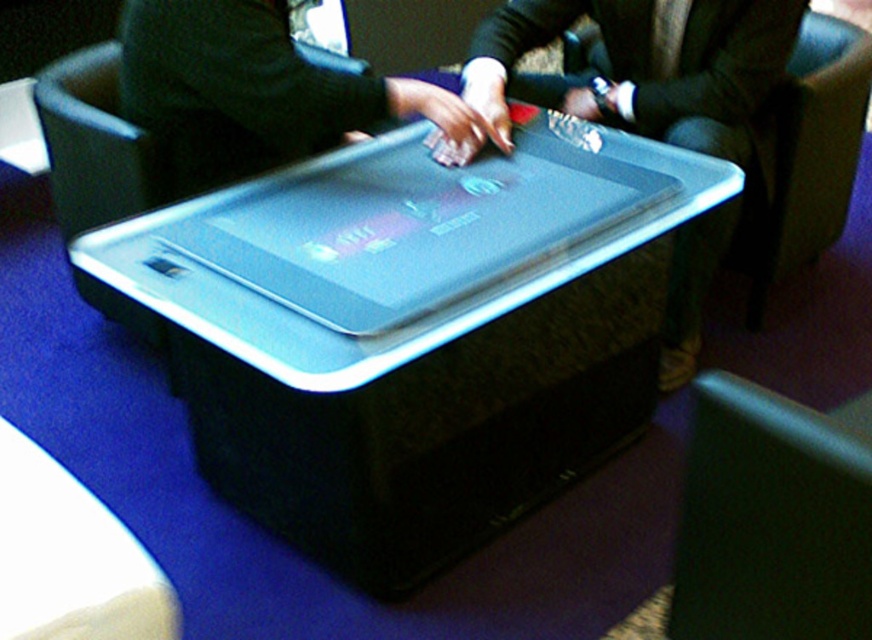
You are sitting in the smooth leather armchair at lower right and want to hand an item to the person in the dark green fabric armchair at right. Which direction should you move your hand to reach them?

Since the smooth leather armchair at lower right is closer to the viewer than the dark green fabric armchair at right, you should move your hand forward to reach the person in the dark green fabric armchair at right.

You are sitting in the dark green fabric armchair at right and want to pick up the clear plastic tray at center. Is the tray within easy reach from your current position?

The clear plastic tray at center is closer to the viewer than the dark green fabric armchair at right, so it is likely within easy reach.